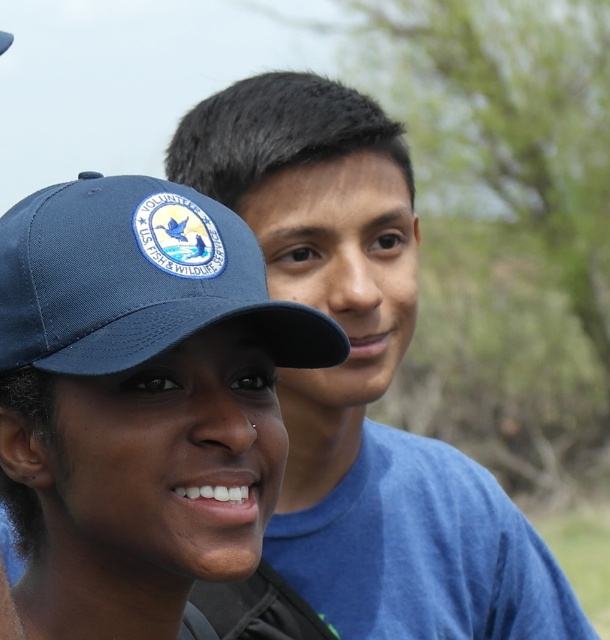
Question: Which object appears closest to the camera in this image?

Choices:
 (A) matte blue shirt at upper right
 (B) blue fabric baseball cap at upper left

Answer: (B)

Question: Considering the relative positions of matte blue shirt at upper right and blue fabric baseball cap at upper left in the image provided, where is matte blue shirt at upper right located with respect to blue fabric baseball cap at upper left?

Choices:
 (A) left
 (B) right

Answer: (B)

Question: Does blue fabric cap at center appear over blue fabric baseball cap at upper left?

Choices:
 (A) yes
 (B) no

Answer: (B)

Question: Can you confirm if blue fabric cap at center is positioned above matte blue shirt at upper right?

Choices:
 (A) no
 (B) yes

Answer: (A)

Question: Which object is positioned closest to the blue fabric baseball cap at upper left?

Choices:
 (A) blue fabric cap at center
 (B) matte blue shirt at upper right

Answer: (A)

Question: Considering the real-world distances, which object is closest to the blue fabric cap at center?

Choices:
 (A) matte blue shirt at upper right
 (B) blue fabric baseball cap at upper left

Answer: (B)